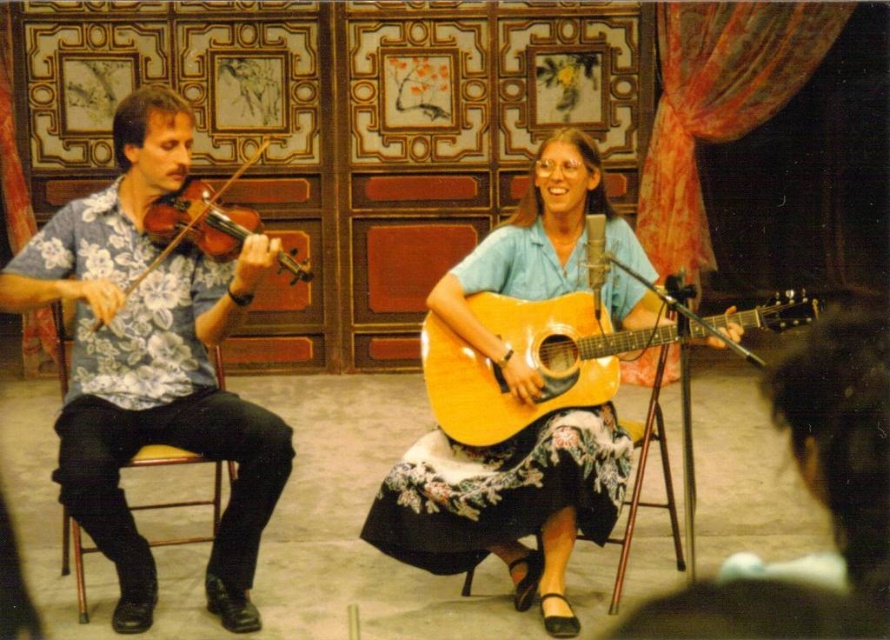
Does glossy wood guitar at center lie in front of wooden violin at left?

That is True.

Measure the distance between point [551,358] and camera.

Point [551,358] is 3.46 meters from camera.

Between point (640, 340) and point (211, 232), which one is positioned behind?

The point (211, 232) is behind.

I want to click on glossy wood guitar at center, so click(527, 362).

Can you confirm if wooden violin at left is shorter than yellow wood chair at left?

Indeed, wooden violin at left has a lesser height compared to yellow wood chair at left.

Is point (289, 272) closer to camera compared to point (65, 317)?

No, it is not.

Image resolution: width=890 pixels, height=640 pixels. I want to click on wooden violin at left, so click(199, 220).

Consider the image. Can you confirm if floral print shirt at left is positioned to the right of glossy wood guitar at center?

Incorrect, floral print shirt at left is not on the right side of glossy wood guitar at center.

Is floral print shirt at left closer to camera compared to glossy wood guitar at center?

No, it is behind glossy wood guitar at center.

Locate an element on the screen. The width and height of the screenshot is (890, 640). floral print shirt at left is located at coordinates (151, 362).

The width and height of the screenshot is (890, 640). Identify the location of floral print shirt at left. click(x=151, y=362).